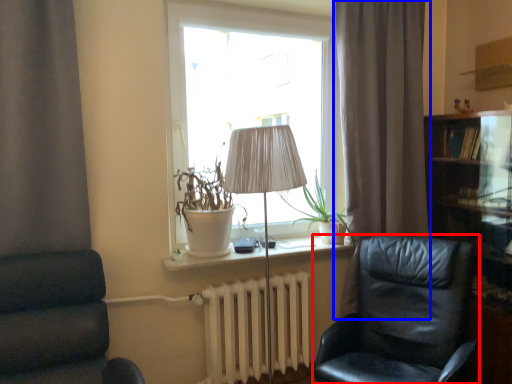
Question: Which object is closer to the camera taking this photo, chair (highlighted by a red box) or curtain (highlighted by a blue box)?

Choices:
 (A) chair
 (B) curtain

Answer: (A)